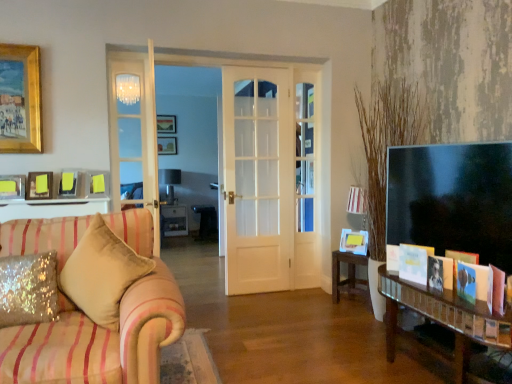
Where is `free region on the left part of wooden table at center, which ranks as the second table in back-to-front order`? free region on the left part of wooden table at center, which ranks as the second table in back-to-front order is located at coordinates (319, 306).